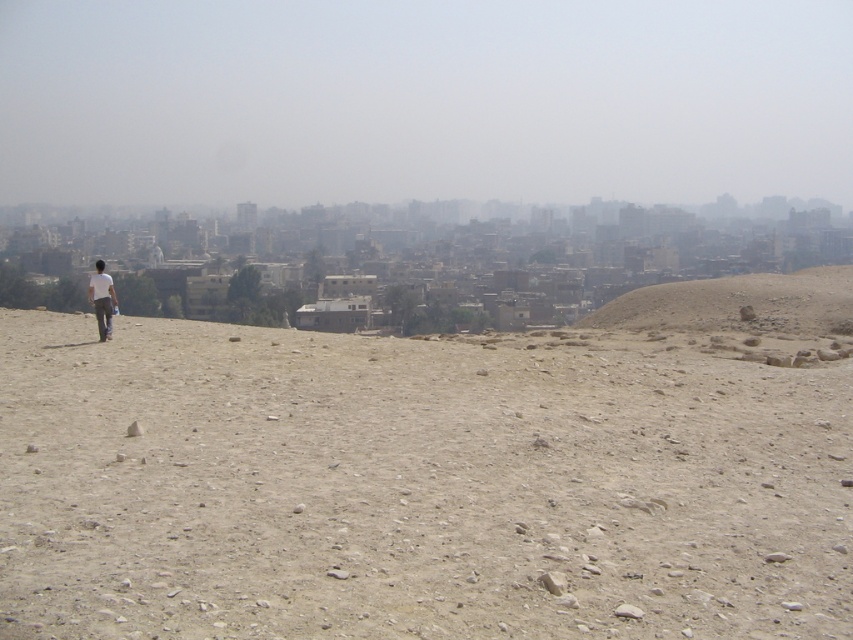
You are a hiker lost in the desert. You see a desert sand hill at right and a white matte shirt at center. Which object is closer to you?

The desert sand hill at right is closer to you because the white matte shirt at center is behind it.